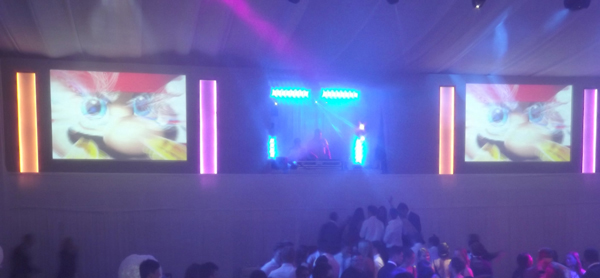
At what (x,y) coordinates should I click in order to perform the action: click on light on ceiling. Please return your answer as a coordinate pair (x, y). Looking at the image, I should click on (475, 10).